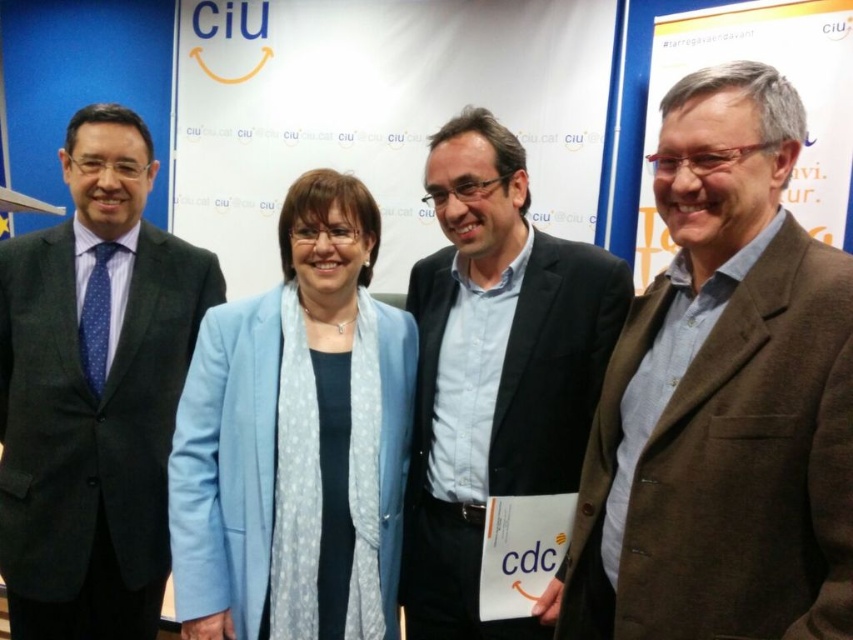
Does brown woolen blazer at right have a lesser width compared to dark gray suit at left?

Indeed, brown woolen blazer at right has a lesser width compared to dark gray suit at left.

Does brown woolen blazer at right appear on the right side of dark gray suit at left?

Yes, brown woolen blazer at right is to the right of dark gray suit at left.

Who is more distant from viewer, [663,308] or [96,147]?

Point [96,147]

Find the location of a particular element. brown woolen blazer at right is located at coordinates (723, 397).

Between dark gray suit at left and blue shirt at center, which one has more height?

dark gray suit at left

Does dark gray suit at left have a greater width compared to blue shirt at center?

Incorrect, dark gray suit at left's width does not surpass blue shirt at center's.

Does point (70, 570) come in front of point (518, 241)?

That is False.

Image resolution: width=853 pixels, height=640 pixels. Identify the location of dark gray suit at left. (93, 392).

Which of these two, matte blue jacket at center or blue shirt at center, stands taller?

Standing taller between the two is blue shirt at center.

Does matte blue jacket at center appear on the right side of blue shirt at center?

No, matte blue jacket at center is not to the right of blue shirt at center.

Which is behind, point (250, 528) or point (519, 403)?

Point (519, 403)

Where is `matte blue jacket at center`? The height and width of the screenshot is (640, 853). matte blue jacket at center is located at coordinates (296, 440).